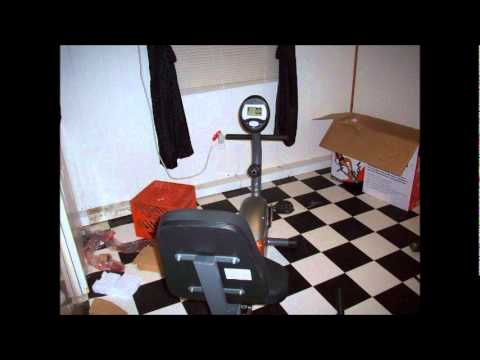
Find the location of `floor checkered`. floor checkered is located at coordinates (325, 237).